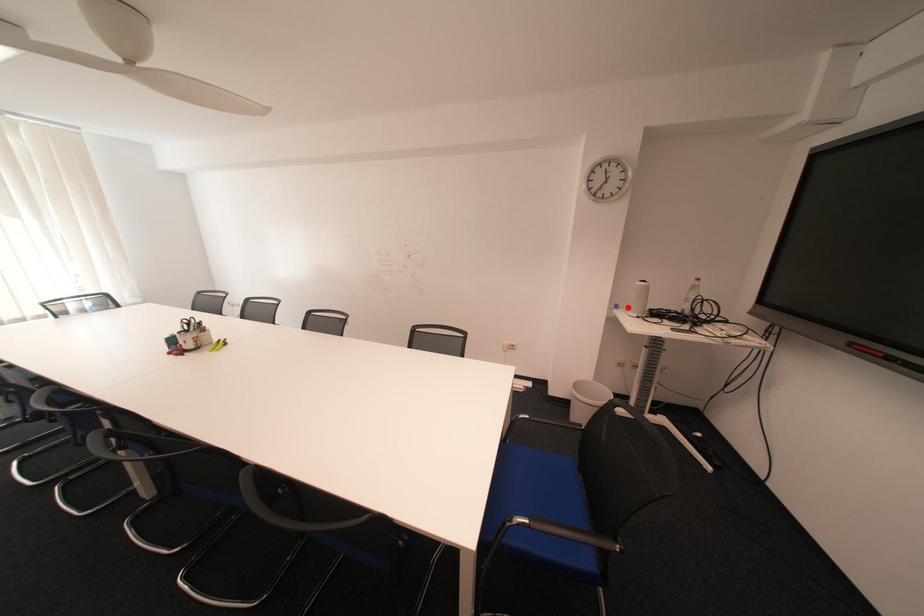
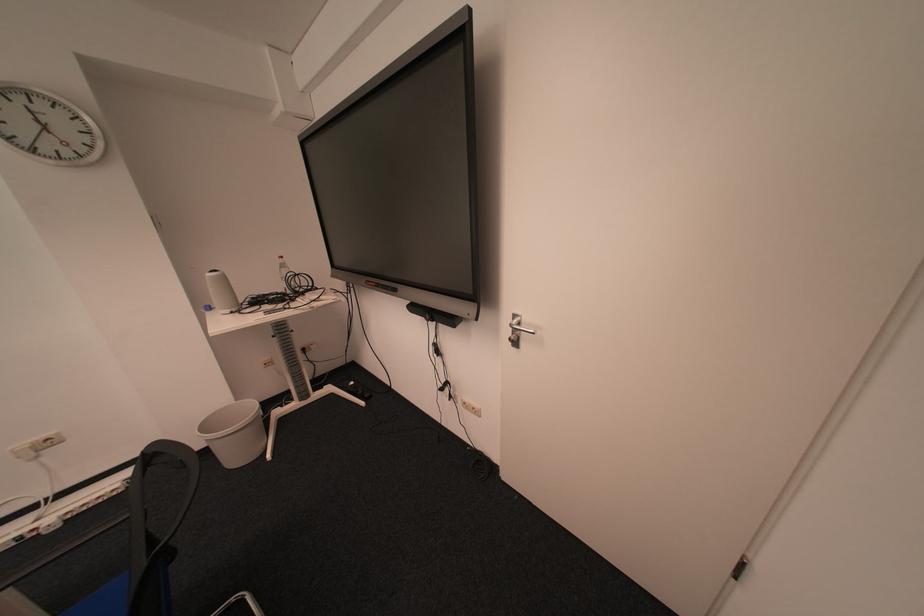
In the second image, find the point that corresponds to the highlighted location in the first image.

(221, 309)